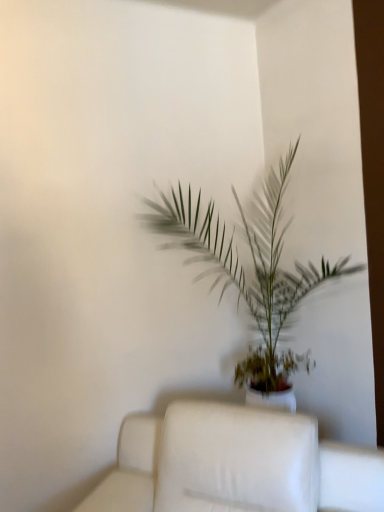
Question: From the image's perspective, is white fabric couch at center above green leafy plant at center?

Choices:
 (A) no
 (B) yes

Answer: (A)

Question: Is white fabric couch at center shorter than green leafy plant at center?

Choices:
 (A) yes
 (B) no

Answer: (A)

Question: Does white fabric couch at center lie behind green leafy plant at center?

Choices:
 (A) no
 (B) yes

Answer: (A)

Question: Could you tell me if white fabric couch at center is turned towards green leafy plant at center?

Choices:
 (A) yes
 (B) no

Answer: (B)

Question: From the image's perspective, is white fabric couch at center beneath green leafy plant at center?

Choices:
 (A) no
 (B) yes

Answer: (B)

Question: Considering the relative positions of white fabric couch at center and green leafy plant at center in the image provided, is white fabric couch at center to the left of green leafy plant at center from the viewer's perspective?

Choices:
 (A) yes
 (B) no

Answer: (A)

Question: From the image's perspective, would you say green leafy plant at center is positioned over white fabric couch at center?

Choices:
 (A) yes
 (B) no

Answer: (A)

Question: Is green leafy plant at center turned away from white fabric couch at center?

Choices:
 (A) no
 (B) yes

Answer: (A)

Question: From the image's perspective, is green leafy plant at center below white fabric couch at center?

Choices:
 (A) yes
 (B) no

Answer: (B)

Question: Can you confirm if green leafy plant at center is thinner than white fabric couch at center?

Choices:
 (A) yes
 (B) no

Answer: (A)

Question: Is green leafy plant at center at the right side of white fabric couch at center?

Choices:
 (A) no
 (B) yes

Answer: (B)

Question: Is green leafy plant at center at the left side of white fabric couch at center?

Choices:
 (A) yes
 (B) no

Answer: (B)

Question: Considering their positions, is white fabric couch at center located in front of or behind green leafy plant at center?

Choices:
 (A) front
 (B) behind

Answer: (A)